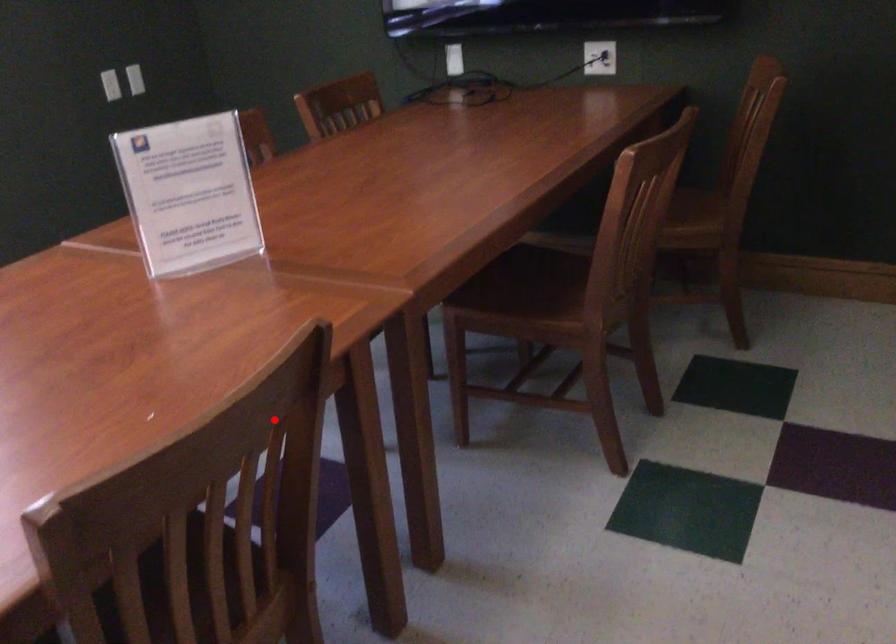
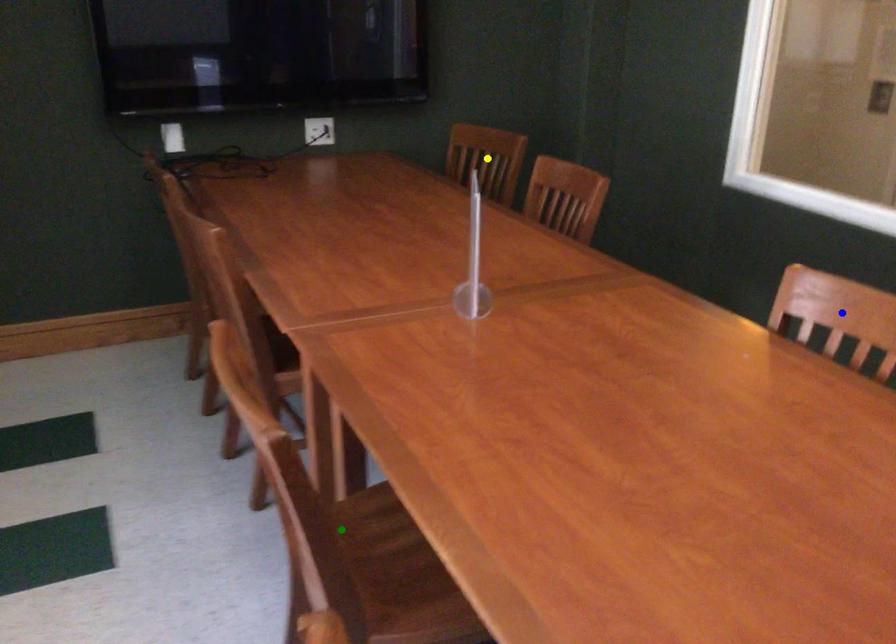
Question: I am providing you with two images of the same scene from different viewpoints. A red point is marked on the first image. You are given multiple points on the second image. Can you choose the point in image 2 that corresponds to the point in image 1?

Choices:
 (A) green point
 (B) blue point
 (C) yellow point

Answer: (B)